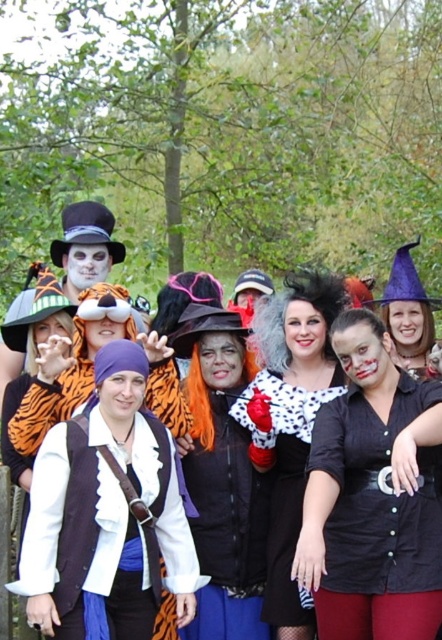
Question: Estimate the real-world distances between objects in this image. Which object is closer to the matte black shirt at center?

Choices:
 (A) orange wig at center
 (B) polka dot blouse at center
 (C) orange tiger costume at center

Answer: (B)

Question: Which point is farther to the camera?

Choices:
 (A) orange tiger costume at center
 (B) matte black shirt at center
 (C) polka dot blouse at center

Answer: (A)

Question: Considering the relative positions of orange tiger costume at center and polka dot blouse at center in the image provided, where is orange tiger costume at center located with respect to polka dot blouse at center?

Choices:
 (A) right
 (B) left

Answer: (A)

Question: Is matte black shirt at center in front of orange wig at center?

Choices:
 (A) no
 (B) yes

Answer: (B)

Question: Can you confirm if orange wig at center is positioned below polka dot blouse at center?

Choices:
 (A) no
 (B) yes

Answer: (B)

Question: Considering the real-world distances, which object is farthest from the matte black shirt at center?

Choices:
 (A) orange tiger costume at center
 (B) orange wig at center
 (C) polka dot blouse at center

Answer: (A)